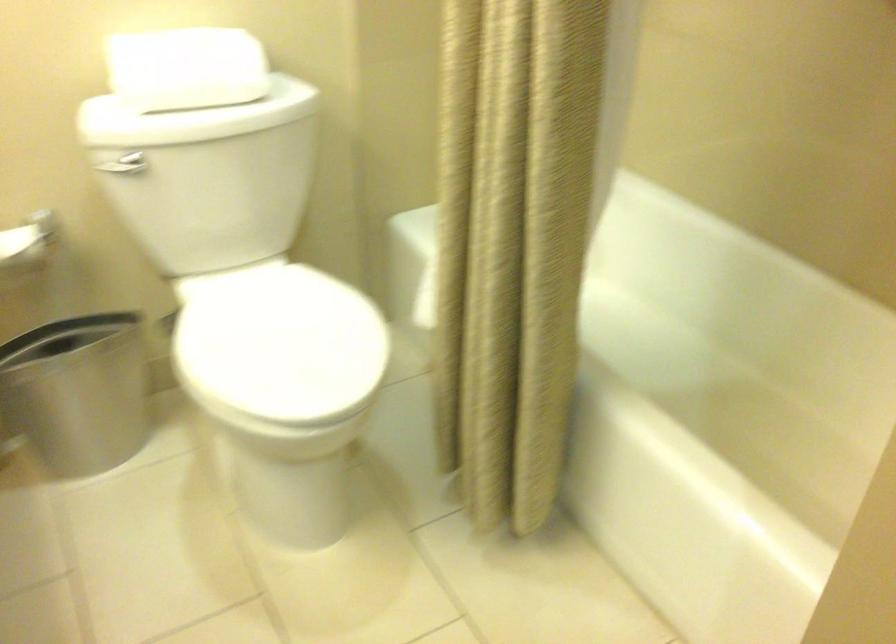
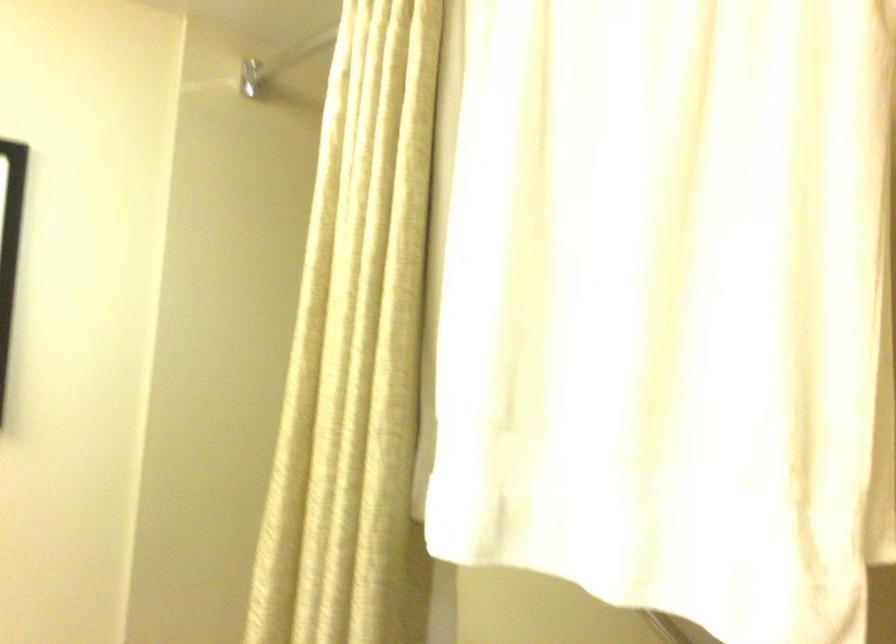
Based on the continuous images, in which direction is the camera rotating?

The rotation direction of the camera is right-up.